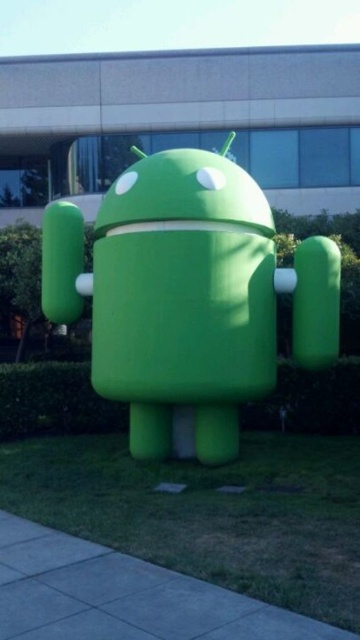
Question: Can you confirm if green matte robot at center is thinner than gray concrete pavement at lower left?

Choices:
 (A) yes
 (B) no

Answer: (B)

Question: In this image, where is green matte robot at center located relative to gray concrete pavement at lower left?

Choices:
 (A) above
 (B) below

Answer: (A)

Question: Which point is farther from the camera taking this photo?

Choices:
 (A) (210, 582)
 (B) (183, 330)

Answer: (B)

Question: Is green matte robot at center to the left of gray concrete pavement at lower left from the viewer's perspective?

Choices:
 (A) yes
 (B) no

Answer: (B)

Question: Which of the following is the farthest from the observer?

Choices:
 (A) (217, 227)
 (B) (56, 589)

Answer: (A)

Question: Which point appears closest to the camera in this image?

Choices:
 (A) (162, 324)
 (B) (141, 614)

Answer: (B)